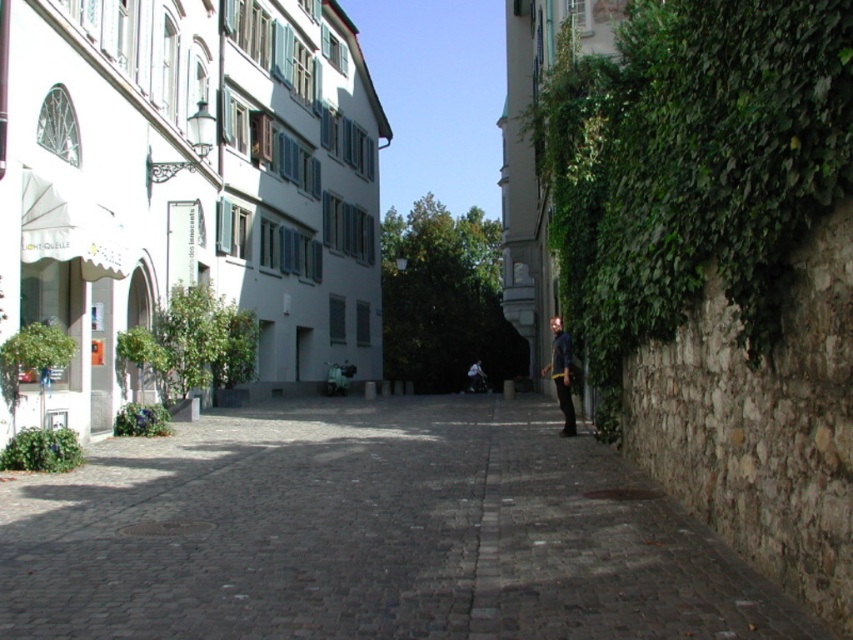
Question: Which of the following is the closest to the observer?

Choices:
 (A) (563, 406)
 (B) (30, 637)

Answer: (B)

Question: Does dark gray cobblestone at center appear over dark blue denim jacket at right?

Choices:
 (A) no
 (B) yes

Answer: (A)

Question: Among these objects, which one is nearest to the camera?

Choices:
 (A) dark gray cobblestone at center
 (B) dark blue denim jacket at right

Answer: (A)

Question: In this image, where is dark gray cobblestone at center located relative to dark blue denim jacket at right?

Choices:
 (A) right
 (B) left

Answer: (B)

Question: Is dark gray cobblestone at center in front of dark blue denim jacket at right?

Choices:
 (A) yes
 (B) no

Answer: (A)